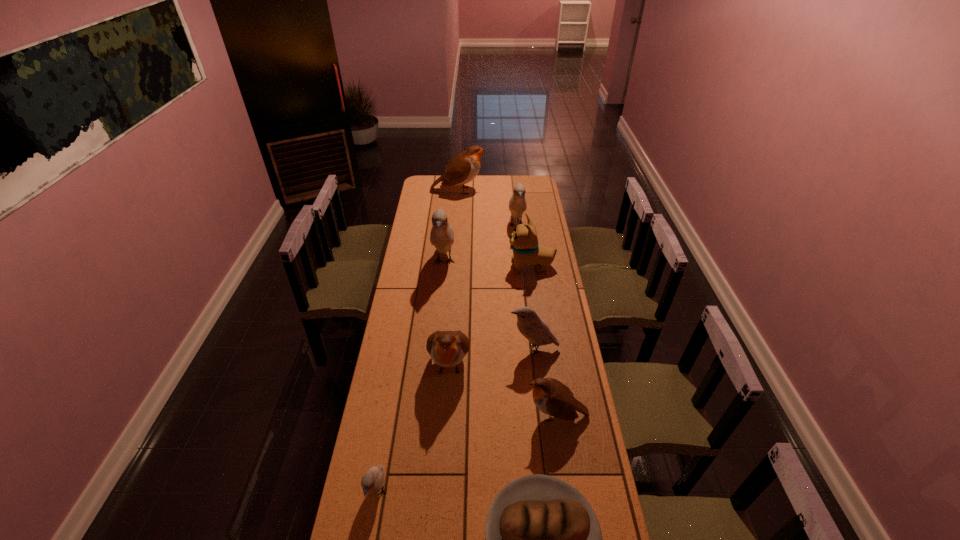
Identify the location of the tallest bird. The width and height of the screenshot is (960, 540). (442, 235).

Find the location of a particular element. Image resolution: width=960 pixels, height=540 pixels. the biggest white bird is located at coordinates (442, 235).

The width and height of the screenshot is (960, 540). Identify the location of the farthest object. (463, 168).

At what (x,y) coordinates should I click in order to perform the action: click on the farthest bird. Please return your answer as a coordinate pair (x, y). The height and width of the screenshot is (540, 960). Looking at the image, I should click on (463, 168).

Locate an element on the screen. The width and height of the screenshot is (960, 540). the second biggest white bird is located at coordinates (517, 205).

This screenshot has width=960, height=540. I want to click on the second farthest object, so click(517, 205).

At what (x,y) coordinates should I click in order to perform the action: click on puppy. Please return your answer as a coordinate pair (x, y). Looking at the image, I should click on (523, 241).

Where is `the second nearest brown bird`? This screenshot has width=960, height=540. the second nearest brown bird is located at coordinates (447, 349).

Identify the location of the second nearest white bird. (531, 326).

You are a GUI agent. You are given a task and a screenshot of the screen. Output one action in this format:
    pyautogui.click(x=<x>, y=<y>)
    Task: Click on the nearest brown bird
    This screenshot has height=540, width=960.
    Given the screenshot: What is the action you would take?
    pyautogui.click(x=552, y=397)